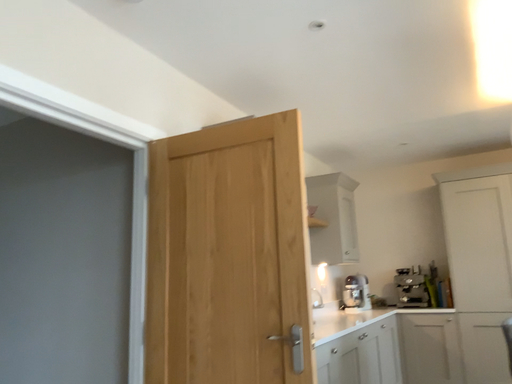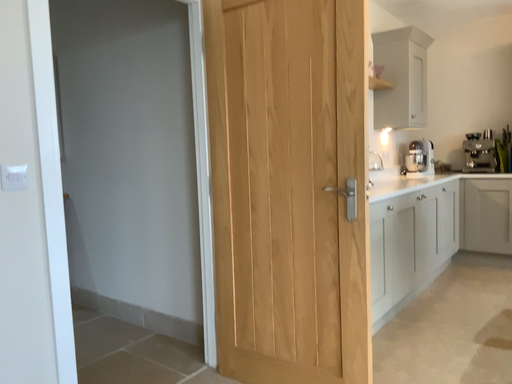
Question: How did the camera likely rotate when shooting the video?

Choices:
 (A) rotated left
 (B) rotated right

Answer: (A)